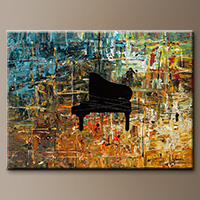
Where is `art piece`? This screenshot has width=200, height=200. art piece is located at coordinates (145, 72).